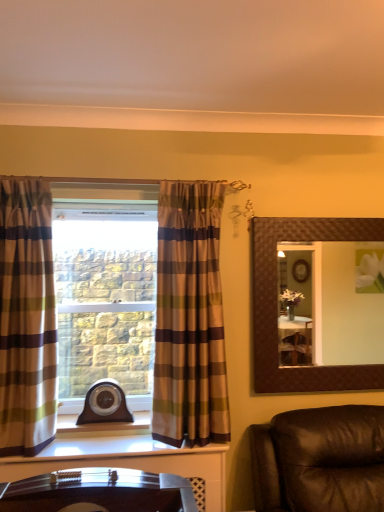
Question: From the image's perspective, relative to plaid fabric curtain at left, which is the 2th curtain in left-to-right order, is plaid fabric curtain at left, the first curtain from the left, above or below?

Choices:
 (A) below
 (B) above

Answer: (B)

Question: Relative to plaid fabric curtain at left, positioned as the 1th curtain in right-to-left order, is plaid fabric curtain at left, the first curtain from the left, in front or behind?

Choices:
 (A) behind
 (B) front

Answer: (B)

Question: Which of these objects is positioned closest to the brown textured mirror at upper right?

Choices:
 (A) plaid fabric curtain at left, positioned as the 1th curtain in right-to-left order
 (B) plaid fabric curtain at left, the 2th curtain positioned from the right

Answer: (A)

Question: Estimate the real-world distances between objects in this image. Which object is farther from the plaid fabric curtain at left, the first curtain from the left?

Choices:
 (A) brown textured mirror at upper right
 (B) plaid fabric curtain at left, which is the 2th curtain in left-to-right order

Answer: (A)